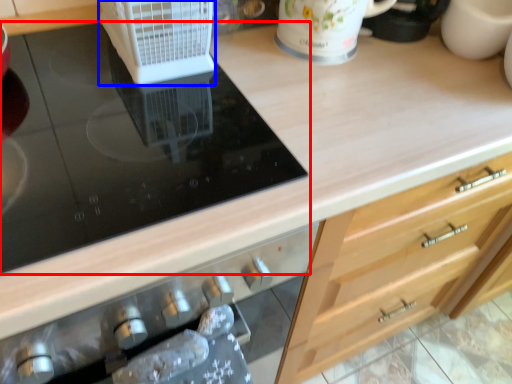
Question: Which object is further to the camera taking this photo, gas stove (highlighted by a red box) or kitchen appliance (highlighted by a blue box)?

Choices:
 (A) gas stove
 (B) kitchen appliance

Answer: (B)